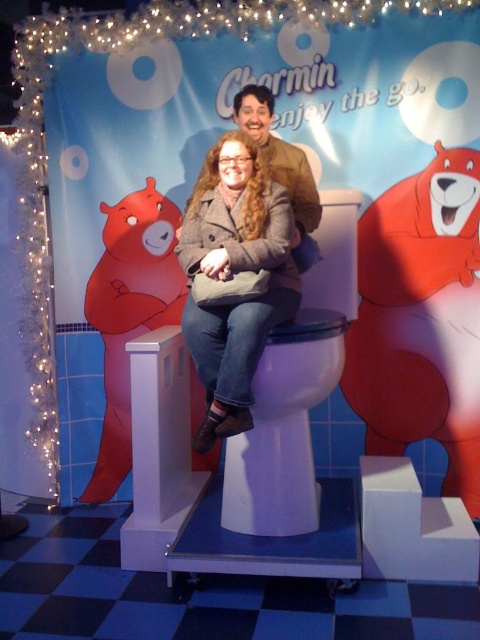
You are designing a storage space and need to place the matte gray coat at center and the white glossy toilet bowl at center side by side. Which object can fit into a narrower space?

The matte gray coat at center is thinner than the white glossy toilet bowl at center, so it can fit into a narrower space.

You are standing at the promotional setup for Charmin toilet paper. You notice two points marked in the scene. Which point is closer to you, point (x=395, y=308) or point (x=143, y=234)?

Point (x=395, y=308) is in front of point (x=143, y=234), so it is closer to you.